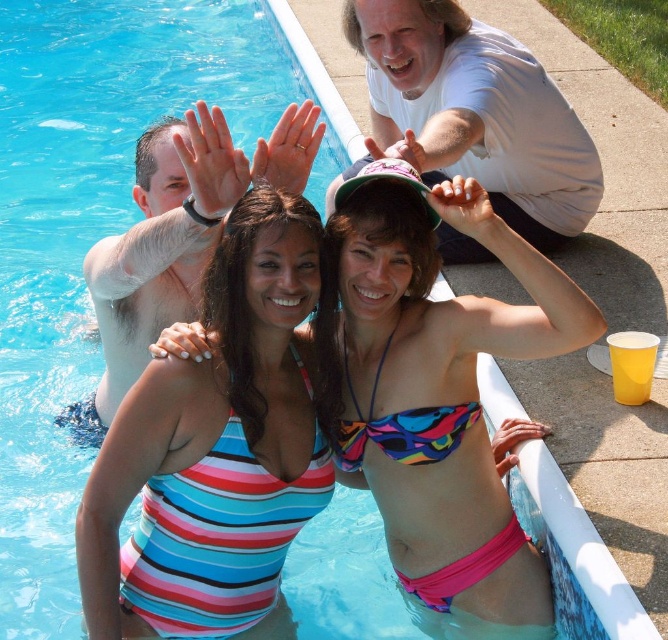
Question: Which object is farther from the camera taking this photo?

Choices:
 (A) multicolored fabric bikini at center
 (B) smooth skin man at left

Answer: (A)

Question: Considering the real-world distances, which object is closest to the striped fabric bikini at center?

Choices:
 (A) white cotton shirt at upper center
 (B) smooth skin man at left

Answer: (B)

Question: Does striped fabric bikini at center come in front of multicolored printed bikini top at center?

Choices:
 (A) yes
 (B) no

Answer: (A)

Question: Is multicolored fabric bikini at center thinner than multicolored printed bikini top at center?

Choices:
 (A) yes
 (B) no

Answer: (B)

Question: Which object appears farthest from the camera in this image?

Choices:
 (A) striped fabric bikini at center
 (B) multicolored printed bikini top at center

Answer: (B)

Question: Can you confirm if striped fabric bikini at center is positioned to the left of multicolored fabric bikini at center?

Choices:
 (A) yes
 (B) no

Answer: (A)